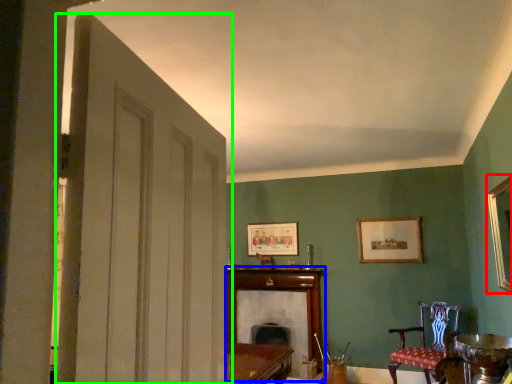
Question: Considering the real-world distances, which object is farthest from picture frame (highlighted by a red box)? fireplace (highlighted by a blue box) or door (highlighted by a green box)?

Choices:
 (A) fireplace
 (B) door

Answer: (A)